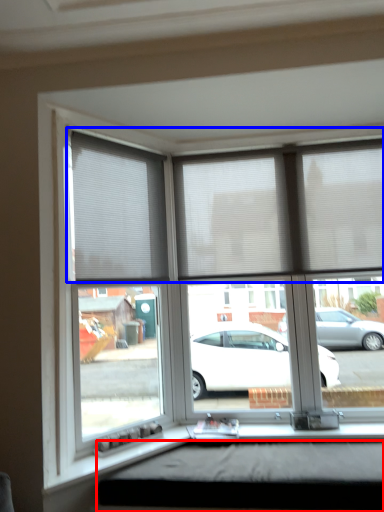
Question: Which of the following is the farthest to the observer, window box (highlighted by a red box) or blind (highlighted by a blue box)?

Choices:
 (A) window box
 (B) blind

Answer: (B)